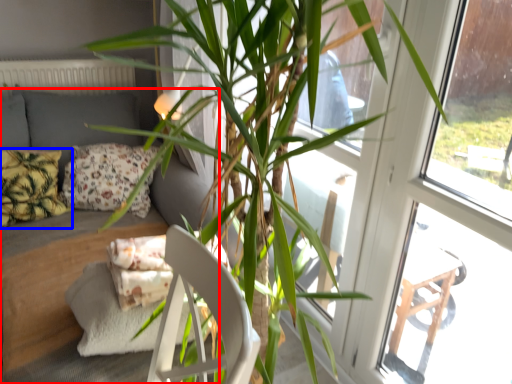
Question: Which object is further to the camera taking this photo, studio couch (highlighted by a red box) or pillow (highlighted by a blue box)?

Choices:
 (A) studio couch
 (B) pillow

Answer: (B)